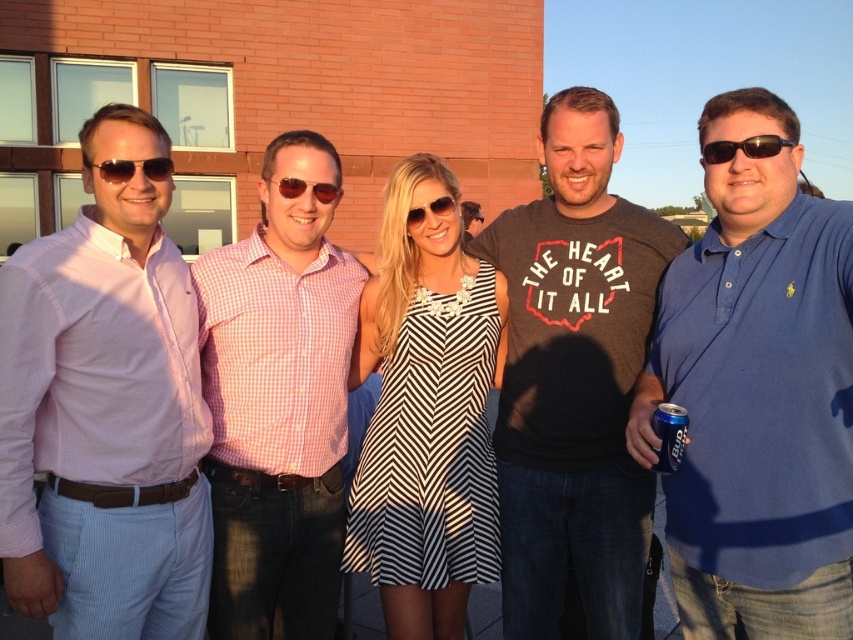
Question: Can you confirm if blue cotton polo shirt at right is positioned above matte black t-shirt at center?

Choices:
 (A) no
 (B) yes

Answer: (A)

Question: Among these objects, which one is nearest to the camera?

Choices:
 (A) blue metallic can at lower right
 (B) blue cotton polo shirt at right
 (C) pink checkered shirt at left
 (D) brown reflective sunglasses at center

Answer: (B)

Question: Is pink checkered shirt at left bigger than matte black sunglasses at left?

Choices:
 (A) yes
 (B) no

Answer: (A)

Question: Which point is closer to the camera?

Choices:
 (A) (328, 604)
 (B) (434, 202)

Answer: (B)

Question: Which object is closer to the camera taking this photo?

Choices:
 (A) matte black t-shirt at center
 (B) dark gray t-shirt at center
 (C) blue metallic can at lower right

Answer: (C)

Question: Does pink checkered shirt at left appear over matte black t-shirt at center?

Choices:
 (A) no
 (B) yes

Answer: (A)